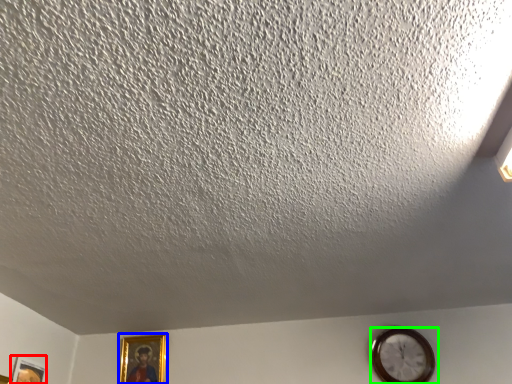
Question: Based on their relative distances, which object is nearer to picture frame (highlighted by a red box)? Choose from picture frame (highlighted by a blue box) and wall clock (highlighted by a green box).

Choices:
 (A) picture frame
 (B) wall clock

Answer: (A)